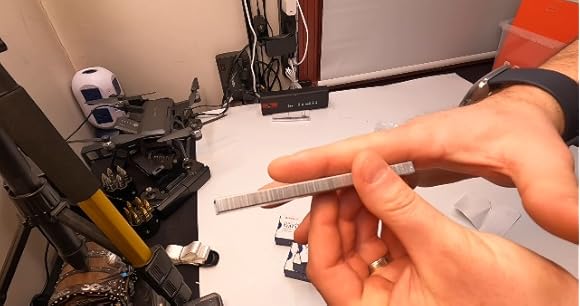
This screenshot has height=306, width=580. What are the coordinates of `walls` in the screenshot? It's located at (139, 21), (27, 47).